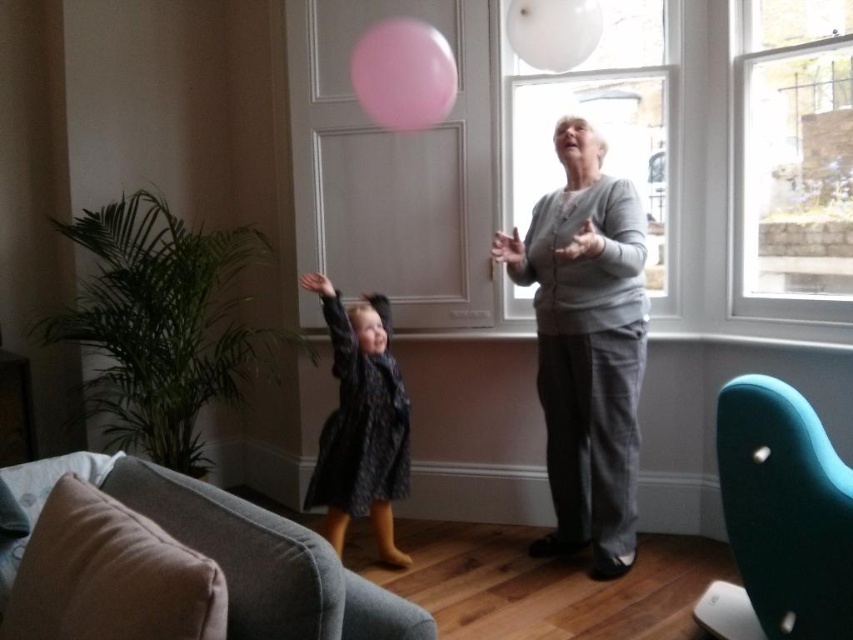
Question: Among these objects, which one is nearest to the camera?

Choices:
 (A) clear glass window at upper right
 (B) soft gray fabric armchair at lower left
 (C) gray cotton sweater at upper center

Answer: (B)

Question: Is teal fabric armchair at lower right to the right of pink rubber balloon at upper center from the viewer's perspective?

Choices:
 (A) no
 (B) yes

Answer: (B)

Question: Is clear glass window at upper right above transparent glass window at upper center?

Choices:
 (A) no
 (B) yes

Answer: (A)

Question: Based on their relative distances, which object is farther from the teal fabric armchair at lower right?

Choices:
 (A) soft gray fabric armchair at lower left
 (B) clear glass window at upper right
 (C) pink rubber balloon at upper center
 (D) fluffy dark blue coat at center

Answer: (C)

Question: Which of the following is the closest to the observer?

Choices:
 (A) transparent glass window at upper center
 (B) fluffy dark blue coat at center
 (C) teal fabric armchair at lower right
 (D) pink rubber balloon at upper center

Answer: (C)

Question: Can you confirm if clear glass window at upper right is positioned to the right of transparent glass window at upper center?

Choices:
 (A) yes
 (B) no

Answer: (A)